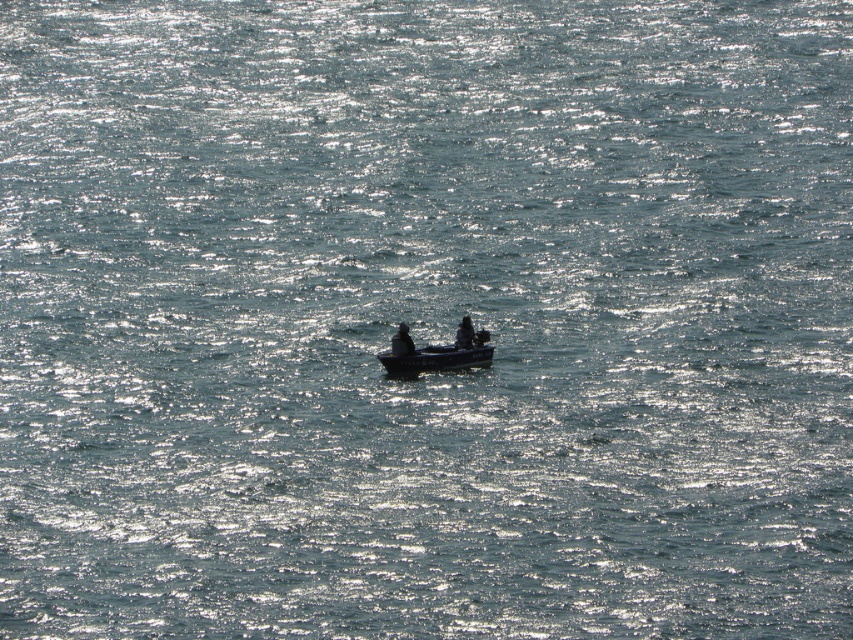
You are navigating a small boat and need to determine the position of two points on the boat. The first point is labeled as point (424, 358) and the second is point (469, 346). Which point is closer to the front of the boat?

Point (424, 358) is in front of point (469, 346), so it is closer to the front of the boat.

You are navigating a boat and need to determine the position of two points on your radar. The points are labeled as point 1 at coordinates point (390, 348) and point 2 at coordinates point (463, 317). Based on the scene, which point is closer to the front of the boat?

Point 1 at coordinates point (390, 348) is closer to the front of the boat because it is positioned in front of point 2 at coordinates point (463, 317).

From the picture: You are a passenger on a boat and want to know if the smooth dark wood canoe at center is positioned under the dark hair at center. Based on the scene description, can you confirm this?

Yes, according to the scene description, the smooth dark wood canoe at center is below dark hair at center, meaning it is positioned under the dark hair at center.